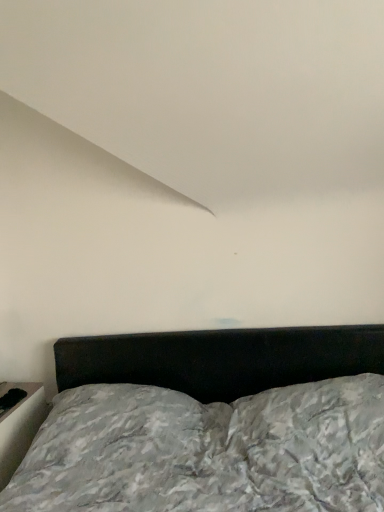
Question: From the image's perspective, is textured gray bed at center beneath white glossy table at lower left?

Choices:
 (A) yes
 (B) no

Answer: (B)

Question: Does textured gray bed at center have a greater height compared to white glossy table at lower left?

Choices:
 (A) no
 (B) yes

Answer: (B)

Question: Considering the relative sizes of textured gray bed at center and white glossy table at lower left in the image provided, is textured gray bed at center shorter than white glossy table at lower left?

Choices:
 (A) yes
 (B) no

Answer: (B)

Question: Does textured gray bed at center turn towards white glossy table at lower left?

Choices:
 (A) yes
 (B) no

Answer: (B)

Question: Does textured gray bed at center have a smaller size compared to white glossy table at lower left?

Choices:
 (A) no
 (B) yes

Answer: (A)

Question: Would you consider textured gray bed at center to be distant from white glossy table at lower left?

Choices:
 (A) no
 (B) yes

Answer: (A)

Question: Can you confirm if white glossy table at lower left is positioned to the right of textured gray bed at center?

Choices:
 (A) no
 (B) yes

Answer: (A)

Question: From the image's perspective, is white glossy table at lower left on textured gray bed at center?

Choices:
 (A) yes
 (B) no

Answer: (B)

Question: Is white glossy table at lower left completely or partially outside of textured gray bed at center?

Choices:
 (A) yes
 (B) no

Answer: (A)

Question: Considering the relative sizes of white glossy table at lower left and textured gray bed at center in the image provided, is white glossy table at lower left thinner than textured gray bed at center?

Choices:
 (A) no
 (B) yes

Answer: (B)

Question: Would you say white glossy table at lower left contains textured gray bed at center?

Choices:
 (A) yes
 (B) no

Answer: (B)

Question: Can you confirm if white glossy table at lower left is taller than textured gray bed at center?

Choices:
 (A) yes
 (B) no

Answer: (B)

Question: From the image's perspective, is white glossy table at lower left above or below textured gray bed at center?

Choices:
 (A) below
 (B) above

Answer: (A)